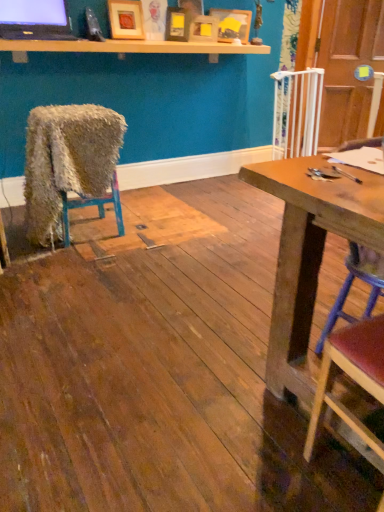
Question: Is point (211, 60) positioned closer to the camera than point (178, 10)?

Choices:
 (A) closer
 (B) farther

Answer: (B)

Question: Based on their sizes in the image, would you say light wood shelf at upper center is bigger or smaller than matte wooden picture frame at upper center, the third picture frame when ordered from right to left?

Choices:
 (A) small
 (B) big

Answer: (B)

Question: Which object is the farthest from the wooden picture frame at upper center, arranged as the third picture frame when viewed from the left?

Choices:
 (A) wooden chair at lower right, the 3th chair viewed from the back
 (B) light wood shelf at upper center
 (C) wooden picture frame at upper center, arranged as the 1th picture frame when viewed from the right
 (D) wooden picture frame at upper center, which is the 4th picture frame from right to left
 (E) fuzzy fabric chair at left, which is the first chair in left-to-right order

Answer: (A)

Question: Which object is positioned farthest from the wooden chair at lower right, the 2th chair when ordered from left to right?

Choices:
 (A) light wood shelf at upper center
 (B) fuzzy fabric chair at left, the third chair viewed from the right
 (C) wooden picture frame at upper center, which is counted as the 4th picture frame, starting from the left
 (D) wooden picture frame at upper center, arranged as the third picture frame when viewed from the left
 (E) wooden seat at right, positioned as the 2th chair in front-to-back order

Answer: (C)